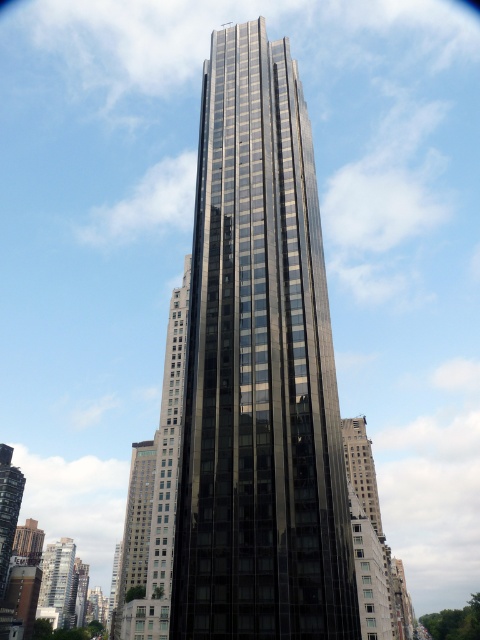
Is the position of glassy reflective building at lower left less distant than that of shiny glass skyscraper at lower left?

That is False.

Is point (60, 573) positioned behind point (0, 522)?

That is True.

Where is `glassy reflective building at lower left`? The image size is (480, 640). glassy reflective building at lower left is located at coordinates (57, 582).

Does glossy glass tower at center appear on the right side of shiny glass skyscraper at lower left?

Yes, glossy glass tower at center is to the right of shiny glass skyscraper at lower left.

Which of these two, glossy glass tower at center or shiny glass skyscraper at lower left, stands taller?

glossy glass tower at center is taller.

Does point (197, 636) come behind point (12, 536)?

No, (197, 636) is in front of (12, 536).

You are a GUI agent. You are given a task and a screenshot of the screen. Output one action in this format:
    pyautogui.click(x=<x>, y=<y>)
    Task: Click on the glossy glass tower at center
    The image size is (480, 640).
    Given the screenshot: What is the action you would take?
    pyautogui.click(x=259, y=371)

Who is more distant from viewer, (142, 454) or (360, 497)?

Point (142, 454)

You are a GUI agent. You are given a task and a screenshot of the screen. Output one action in this format:
    pyautogui.click(x=<x>, y=<y>)
    Task: Click on the shiny glass skyscraper at center
    
    Given the screenshot: What is the action you would take?
    pyautogui.click(x=134, y=531)